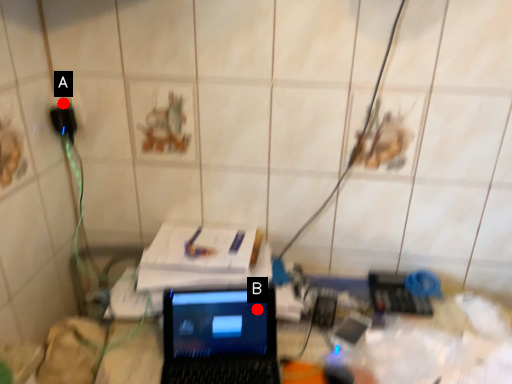
Question: Two points are circled on the image, labeled by A and B beside each circle. Which point appears closest to the camera in this image?

Choices:
 (A) A is closer
 (B) B is closer

Answer: (B)